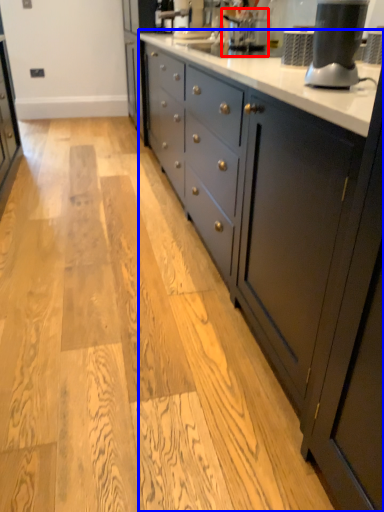
Question: Which object is further to the camera taking this photo, coffee machine (highlighted by a red box) or countertop (highlighted by a blue box)?

Choices:
 (A) coffee machine
 (B) countertop

Answer: (A)